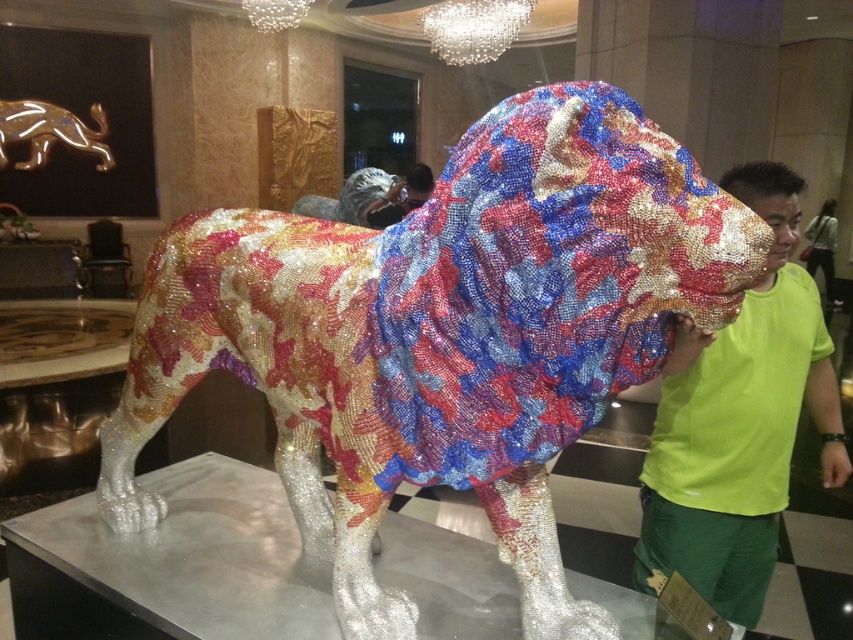
Question: Is green matte shirt at right in front of gold metallic lion at upper left?

Choices:
 (A) no
 (B) yes

Answer: (B)

Question: Does shiny metallic lion at center appear under gold metallic lion at upper left?

Choices:
 (A) yes
 (B) no

Answer: (A)

Question: Which of the following is the closest to the observer?

Choices:
 (A) gold metallic lion at upper left
 (B) green matte shirt at right

Answer: (B)

Question: Observing the image, what is the correct spatial positioning of shiny metallic lion at center in reference to green matte shirt at right?

Choices:
 (A) left
 (B) right

Answer: (A)

Question: Which object appears closest to the camera in this image?

Choices:
 (A) shiny metallic lion at center
 (B) green matte shirt at right
 (C) gold metallic lion at upper left

Answer: (A)

Question: Considering the real-world distances, which object is farthest from the gold metallic lion at upper left?

Choices:
 (A) green matte shirt at right
 (B) shiny metallic lion at center

Answer: (B)